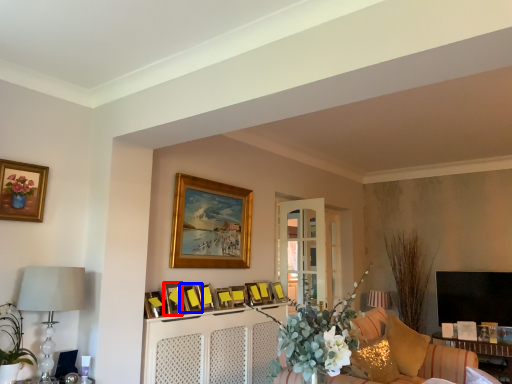
Question: Which object appears farthest to the camera in this image, picture frame (highlighted by a red box) or picture frame (highlighted by a blue box)?

Choices:
 (A) picture frame
 (B) picture frame

Answer: (B)